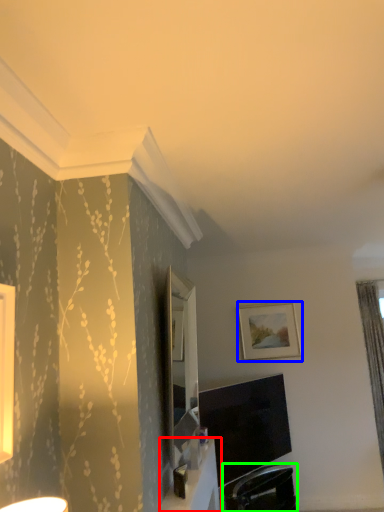
Question: Which object is the farthest from table (highlighted by a red box)? Choose among these: picture frame (highlighted by a blue box) or swivel chair (highlighted by a green box).

Choices:
 (A) picture frame
 (B) swivel chair

Answer: (A)